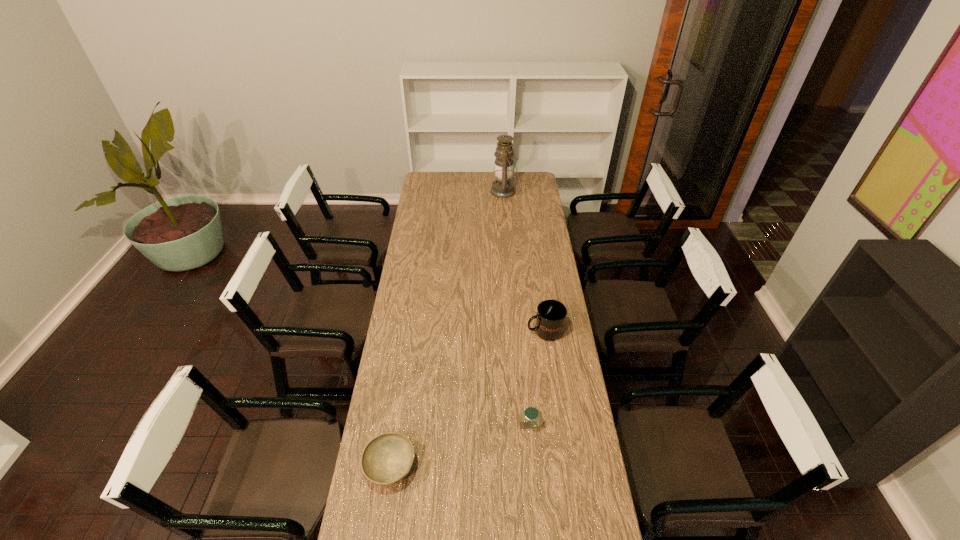
Where is `blank area at the far edge`? This screenshot has width=960, height=540. blank area at the far edge is located at coordinates (470, 174).

Locate an element on the screen. blank space at the left edge of the desktop is located at coordinates (422, 203).

Find the location of `vacant space at the right edge of the desktop`. vacant space at the right edge of the desktop is located at coordinates (569, 376).

Where is `unoccupied position between the farthest object and the watch`? This screenshot has height=540, width=960. unoccupied position between the farthest object and the watch is located at coordinates (x=517, y=308).

Where is `free space between the third nearest object and the second nearest object`? This screenshot has width=960, height=540. free space between the third nearest object and the second nearest object is located at coordinates (537, 378).

Identify the location of free area in between the second tallest object and the oil lamp. (524, 261).

Identify the location of free spot between the second nearest object and the farthest object. pos(517,308).

The width and height of the screenshot is (960, 540). Identify the location of free space between the mug and the shortest object. (468, 399).

What are the coordinates of `vacant area between the second shortest object and the mug` in the screenshot? It's located at (537, 378).

The image size is (960, 540). I want to click on free spot between the third nearest object and the bowl, so (468, 399).